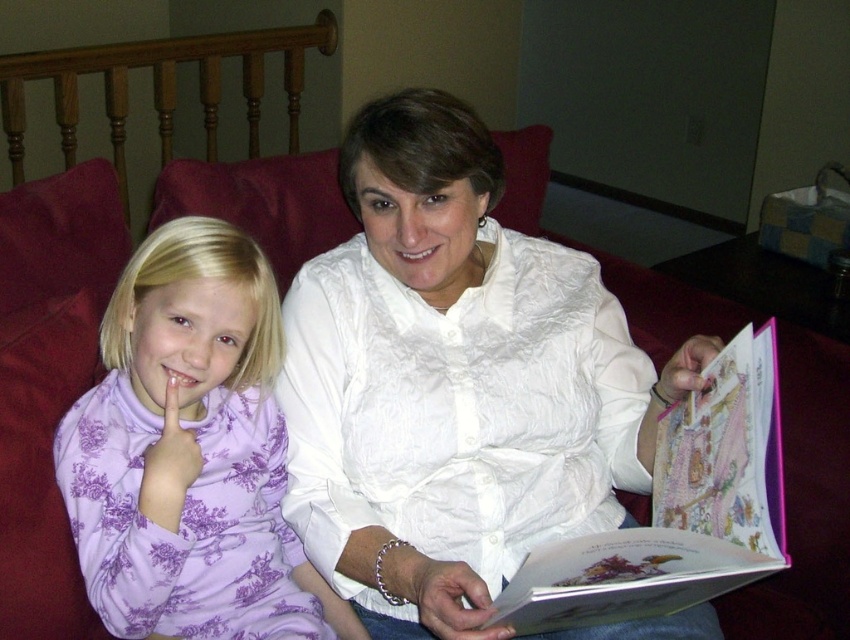
You are standing in the living room and want to place a pink paper book at center on the coffee table located at point 0.5, 0.5. Can you move the book directly to the coffee table without moving any other objects?

The pink paper book at center is at point (x=678, y=509), which is close to the coffee table at (x=425, y=320). However, since there are two people sitting on the red couch in the scene, it might block the path. Therefore, you cannot move the book directly to the coffee table without moving any other objects.

What are the coordinates of the purple floral dress at left in the image?

The purple floral dress at left is located at coordinates point [190,454].

You are a photographer taking a portrait of the purple floral dress at left and the smooth white teeth at center. Based on their positions, which object should you focus on first if you want to capture both in the same frame?

The purple floral dress at left is located below smooth white teeth at center, so you should focus on the smooth white teeth at center first to ensure both are in the frame.